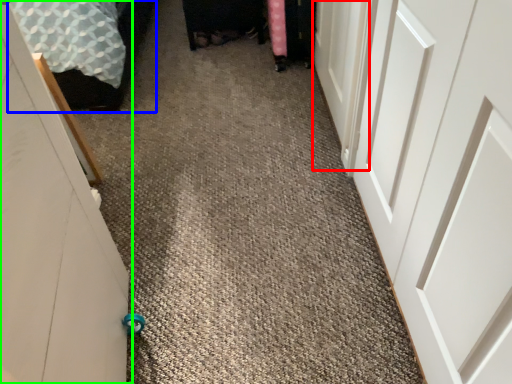
Question: Considering the real-world distances, which object is farthest from door (highlighted by a red box)? bed (highlighted by a blue box) or door (highlighted by a green box)?

Choices:
 (A) bed
 (B) door

Answer: (A)